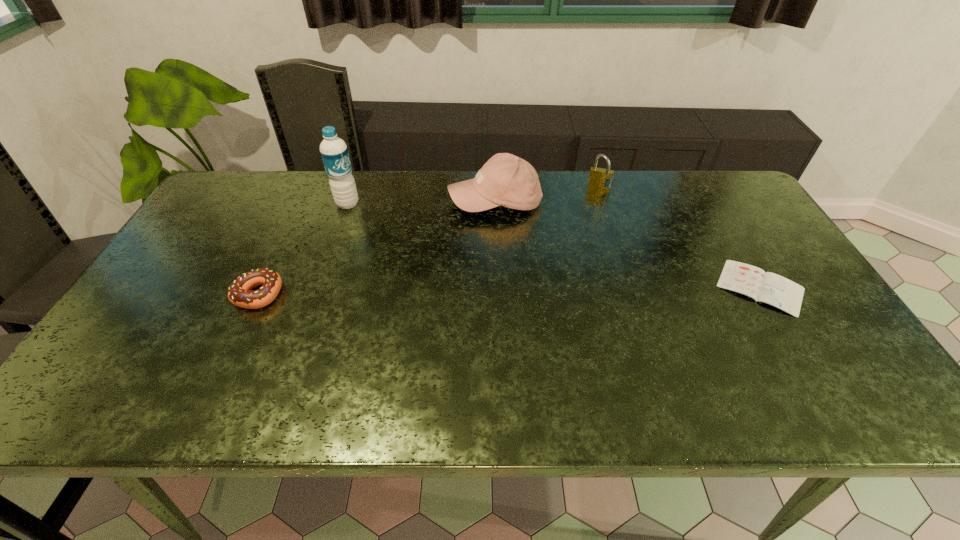
The image size is (960, 540). What are the coordinates of `free spot on the desktop that is between the leftmost object and the rightmost object and is positioned on the side with the combination dials of the padlock` in the screenshot? It's located at (577, 290).

Find the location of a particular element. free space on the desktop that is between the doughnut and the diary and is positioned on the front-facing side of the baseball cap is located at coordinates (440, 292).

Identify the location of free space on the desktop that is between the leftmost object and the shortest object and is positioned on the label of the tallest object. (476, 291).